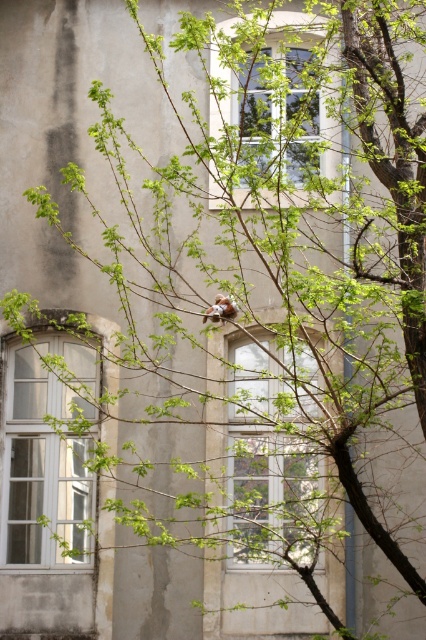
Question: Which object is closer to the camera taking this photo?

Choices:
 (A) clear glass window at center
 (B) clear glass window at upper center
 (C) white glass window at lower left

Answer: (B)

Question: Which point appears closest to the camera in this image?

Choices:
 (A) (32, 408)
 (B) (273, 388)

Answer: (B)

Question: Is the position of clear glass window at center more distant than that of white glass window at lower left?

Choices:
 (A) yes
 (B) no

Answer: (B)

Question: Does clear glass window at center appear on the right side of white glass window at lower left?

Choices:
 (A) yes
 (B) no

Answer: (A)

Question: Which of the following is the farthest from the observer?

Choices:
 (A) white glass window at lower left
 (B) clear glass window at center

Answer: (A)

Question: Is white glass window at lower left positioned at the back of clear glass window at upper center?

Choices:
 (A) no
 (B) yes

Answer: (B)